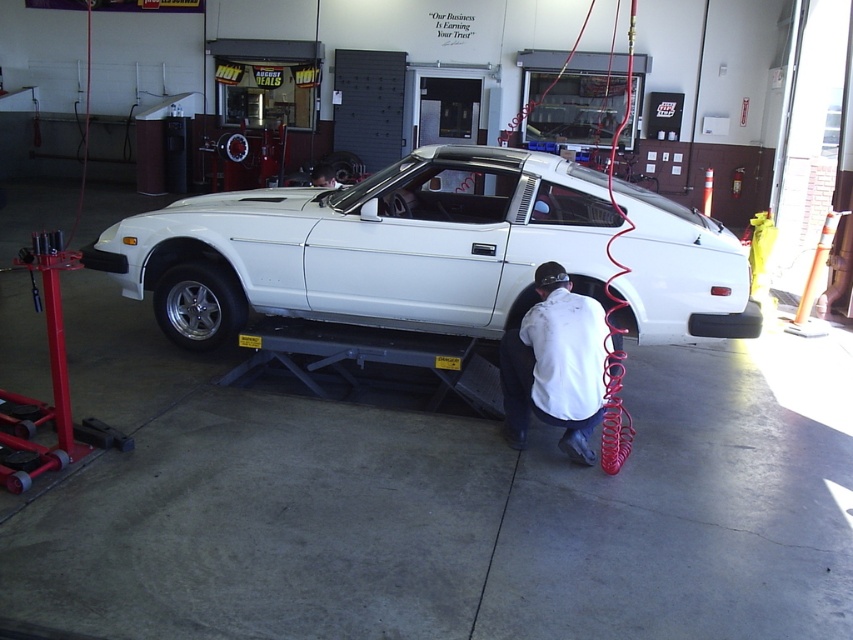
Question: Does white matte car at center have a larger size compared to matte black hair at center?

Choices:
 (A) no
 (B) yes

Answer: (A)

Question: Which object appears closest to the camera in this image?

Choices:
 (A) matte black hair at center
 (B) silver metallic tire at lower left

Answer: (B)

Question: Which of the following is the farthest from the observer?

Choices:
 (A) matte black hair at center
 (B) white matte shirt at lower center
 (C) white matte car at center

Answer: (A)

Question: Observing the image, what is the correct spatial positioning of white matte shirt at lower center in reference to silver metallic tire at lower left?

Choices:
 (A) above
 (B) below

Answer: (B)

Question: Which of the following is the closest to the observer?

Choices:
 (A) (347, 221)
 (B) (589, 330)
 (C) (195, 337)
 (D) (315, 180)

Answer: (B)

Question: Does white matte car at center appear under matte black hair at center?

Choices:
 (A) yes
 (B) no

Answer: (A)